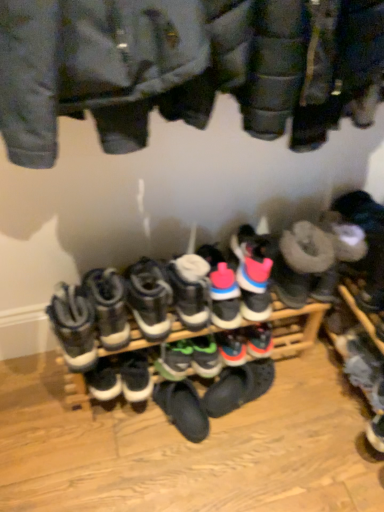
The height and width of the screenshot is (512, 384). Describe the element at coordinates (222, 289) in the screenshot. I see `pink suede sneakers at center, the seventh footwear positioned from the left` at that location.

This screenshot has height=512, width=384. Identify the location of white leather sneakers at center, which appears as the 2th footwear when viewed from the left. (108, 306).

Identify the location of white suede sneaker at lower right, which is the eighth footwear in left-to-right order. tap(363, 366).

Image resolution: width=384 pixels, height=512 pixels. What do you see at coordinates (191, 290) in the screenshot?
I see `white suede sneakers at center, placed as the sixth footwear when sorted from left to right` at bounding box center [191, 290].

Consider the image. Measure the distance between black suede sneaker at center, marked as the third footwear in a left-to-right arrangement, and camera.

A distance of 1.23 meters exists between black suede sneaker at center, marked as the third footwear in a left-to-right arrangement, and camera.

In the scene shown: How much space does black suede sneaker at center, marked as the third footwear in a left-to-right arrangement, occupy horizontally?

11.61 centimeters.

The height and width of the screenshot is (512, 384). I want to click on rubberized black shoes at center, so click(108, 374).

Considering the sizes of white suede sneakers at center, acting as the fourth footwear starting from the right, and white leather sneakers at center, which is the 1th footwear in left-to-right order, in the image, is white suede sneakers at center, acting as the fourth footwear starting from the right, wider or thinner than white leather sneakers at center, which is the 1th footwear in left-to-right order,?

Considering their sizes, white suede sneakers at center, acting as the fourth footwear starting from the right, looks broader than white leather sneakers at center, which is the 1th footwear in left-to-right order.

Where is `the 2nd footwear located above the white leather sneakers at center, which appears as the 9th footwear when viewed from the right (from a real-world perspective)`? the 2nd footwear located above the white leather sneakers at center, which appears as the 9th footwear when viewed from the right (from a real-world perspective) is located at coordinates (191, 290).

Do you think white suede sneakers at center, acting as the fourth footwear starting from the right, is within white leather sneakers at center, which appears as the 9th footwear when viewed from the right, or outside of it?

white suede sneakers at center, acting as the fourth footwear starting from the right, is not enclosed by white leather sneakers at center, which appears as the 9th footwear when viewed from the right.

Consider the image. Who is more distant, white suede sneakers at center, acting as the fourth footwear starting from the right, or white leather sneakers at center, which is the 1th footwear in left-to-right order?

Positioned behind is white suede sneakers at center, acting as the fourth footwear starting from the right.

You are a GUI agent. You are given a task and a screenshot of the screen. Output one action in this format:
    pyautogui.click(x=<x>, y=<y>)
    Task: Click on the 6th footwear in front of the green suede sneakers at center, which is the 5th footwear in left-to-right order, counting from the anchor's position
    This screenshot has height=512, width=384.
    Given the screenshot: What is the action you would take?
    pyautogui.click(x=108, y=306)

Considering the positions of objects white leather sneakers at center, which is the eighth footwear in right-to-left order, and green suede sneakers at center, the fifth footwear positioned from the right, in the image provided, who is more to the right, white leather sneakers at center, which is the eighth footwear in right-to-left order, or green suede sneakers at center, the fifth footwear positioned from the right,?

green suede sneakers at center, the fifth footwear positioned from the right.

Who is shorter, white leather sneakers at center, which appears as the 2th footwear when viewed from the left, or green suede sneakers at center, the fifth footwear positioned from the right?

Standing shorter between the two is green suede sneakers at center, the fifth footwear positioned from the right.

Is the position of white leather sneakers at center, which is the eighth footwear in right-to-left order, less distant than that of green suede sneakers at center, the fifth footwear positioned from the right?

Yes, white leather sneakers at center, which is the eighth footwear in right-to-left order, is in front of green suede sneakers at center, the fifth footwear positioned from the right.

From a real-world perspective, between rubberized black shoes at center and white suede sneakers at center, acting as the fourth footwear starting from the right, who is vertically higher?

In real-world perspective, white suede sneakers at center, acting as the fourth footwear starting from the right, is above.

Is rubberized black shoes at center oriented away from white suede sneakers at center, acting as the fourth footwear starting from the right?

No, rubberized black shoes at center's orientation is not away from white suede sneakers at center, acting as the fourth footwear starting from the right.

Considering the sizes of objects rubberized black shoes at center and white suede sneakers at center, acting as the fourth footwear starting from the right, in the image provided, who is wider, rubberized black shoes at center or white suede sneakers at center, acting as the fourth footwear starting from the right,?

rubberized black shoes at center.

Looking at this image, considering the positions of objects rubberized black shoes at center and white suede sneakers at center, placed as the sixth footwear when sorted from left to right, in the image provided, who is behind, rubberized black shoes at center or white suede sneakers at center, placed as the sixth footwear when sorted from left to right,?

rubberized black shoes at center is further away from the camera.

Is point (138, 351) closer or farther from the camera than point (371, 298)?

Point (138, 351) appears to be closer to the viewer than point (371, 298).

Consider the image. Considering the sizes of objects rubberized black shoes at center and suede boot at right, which is the first footwear from right to left, in the image provided, who is bigger, rubberized black shoes at center or suede boot at right, which is the first footwear from right to left,?

rubberized black shoes at center is bigger.

From the image's perspective, between rubberized black shoes at center and suede boot at right, which is the 9th footwear in left-to-right order, who is located below?

rubberized black shoes at center.

Does white leather sneakers at center, which is the eighth footwear in right-to-left order, have a lesser width compared to pink suede sneakers at center, the seventh footwear positioned from the left?

Yes.

Considering the positions of point (114, 322) and point (211, 280), is point (114, 322) closer or farther from the camera than point (211, 280)?

Point (114, 322).

How much distance is there between white leather sneakers at center, which appears as the 2th footwear when viewed from the left, and pink suede sneakers at center, the seventh footwear positioned from the left?

white leather sneakers at center, which appears as the 2th footwear when viewed from the left, and pink suede sneakers at center, the seventh footwear positioned from the left, are 10.64 inches apart.

Which object is closer to the camera taking this photo, white leather sneakers at center, which appears as the 2th footwear when viewed from the left, or pink suede sneakers at center, the seventh footwear positioned from the left?

Positioned in front is white leather sneakers at center, which appears as the 2th footwear when viewed from the left.

Could you tell me if green suede sneakers at center, which is the 5th footwear in left-to-right order, is turned towards rubberized black shoes at center?

Yes, green suede sneakers at center, which is the 5th footwear in left-to-right order, is oriented towards rubberized black shoes at center.

Is the surface of green suede sneakers at center, which is the 5th footwear in left-to-right order, in direct contact with rubberized black shoes at center?

No, green suede sneakers at center, which is the 5th footwear in left-to-right order, is not making contact with rubberized black shoes at center.

Considering the relative positions of green suede sneakers at center, which is the 5th footwear in left-to-right order, and rubberized black shoes at center in the image provided, is green suede sneakers at center, which is the 5th footwear in left-to-right order, to the left of rubberized black shoes at center from the viewer's perspective?

Yes, green suede sneakers at center, which is the 5th footwear in left-to-right order, is to the left of rubberized black shoes at center.

Which object is thinner, green suede sneakers at center, the fifth footwear positioned from the right, or rubberized black shoes at center?

green suede sneakers at center, the fifth footwear positioned from the right.

Is there a large distance between white leather sneakers at center, which appears as the 2th footwear when viewed from the left, and leather sneakers at center, arranged as the 6th footwear when viewed from the right?

They are positioned close to each other.

Is white leather sneakers at center, which appears as the 2th footwear when viewed from the left, shorter than leather sneakers at center, the 4th footwear in the left-to-right sequence?

In fact, white leather sneakers at center, which appears as the 2th footwear when viewed from the left, may be taller than leather sneakers at center, the 4th footwear in the left-to-right sequence.

In the scene shown: From the image's perspective, which is above, white leather sneakers at center, which appears as the 2th footwear when viewed from the left, or leather sneakers at center, arranged as the 6th footwear when viewed from the right?

leather sneakers at center, arranged as the 6th footwear when viewed from the right, is shown above in the image.

Is white leather sneakers at center, which is the eighth footwear in right-to-left order, oriented towards leather sneakers at center, the 4th footwear in the left-to-right sequence?

No, white leather sneakers at center, which is the eighth footwear in right-to-left order, is not oriented towards leather sneakers at center, the 4th footwear in the left-to-right sequence.

This screenshot has width=384, height=512. In order to click on the 4th footwear above the white leather sneakers at center, which appears as the 9th footwear when viewed from the right (from the image's perspective) in this screenshot , I will do `click(191, 290)`.

Where is `the 6th footwear in front when counting from the green suede sneakers at center, which is the 5th footwear in left-to-right order`? the 6th footwear in front when counting from the green suede sneakers at center, which is the 5th footwear in left-to-right order is located at coordinates (108, 306).

From the image, which object appears to be nearer to white suede sneaker at lower right, positioned as the 2th footwear in right-to-left order, white leather sneakers at center, which appears as the 2th footwear when viewed from the left, or rubberized black shoes at center?

rubberized black shoes at center lies closer to white suede sneaker at lower right, positioned as the 2th footwear in right-to-left order, than the other object.

Consider the image. Which object lies further to the anchor point white suede sneaker at lower right, positioned as the 2th footwear in right-to-left order, suede boot at right, which is the 9th footwear in left-to-right order, or green suede sneakers at center, which is the 5th footwear in left-to-right order?

green suede sneakers at center, which is the 5th footwear in left-to-right order, is further to white suede sneaker at lower right, positioned as the 2th footwear in right-to-left order.

From the image, which object appears to be nearer to pink suede sneakers at center, the seventh footwear positioned from the left, white leather sneakers at center, which appears as the 2th footwear when viewed from the left, or white leather sneakers at center, which is the 1th footwear in left-to-right order?

The object closer to pink suede sneakers at center, the seventh footwear positioned from the left, is white leather sneakers at center, which appears as the 2th footwear when viewed from the left.

Estimate the real-world distances between objects in this image. Which object is further from white suede sneakers at center, placed as the sixth footwear when sorted from left to right, white leather sneakers at center, which appears as the 2th footwear when viewed from the left, or white suede sneaker at lower right, which is the eighth footwear in left-to-right order?

white suede sneaker at lower right, which is the eighth footwear in left-to-right order, lies further to white suede sneakers at center, placed as the sixth footwear when sorted from left to right, than the other object.

Considering their positions, is black suede sneaker at center, the seventh footwear when ordered from right to left, positioned closer to suede boot at right, which is the 9th footwear in left-to-right order, than white suede sneaker at lower right, positioned as the 2th footwear in right-to-left order?

white suede sneaker at lower right, positioned as the 2th footwear in right-to-left order.

Which object lies further to the anchor point white leather sneakers at center, which is the eighth footwear in right-to-left order, leather sneakers at center, arranged as the 6th footwear when viewed from the right, or white suede sneaker at lower right, which is the eighth footwear in left-to-right order?

The object further to white leather sneakers at center, which is the eighth footwear in right-to-left order, is white suede sneaker at lower right, which is the eighth footwear in left-to-right order.

From the image, which object appears to be farther from suede boot at right, which is the first footwear from right to left, white leather sneakers at center, which is the 1th footwear in left-to-right order, or white suede sneaker at lower right, positioned as the 2th footwear in right-to-left order?

Based on the image, white leather sneakers at center, which is the 1th footwear in left-to-right order, appears to be further to suede boot at right, which is the first footwear from right to left.

Considering their positions, is leather sneakers at center, arranged as the 6th footwear when viewed from the right, positioned closer to white suede sneaker at lower right, positioned as the 2th footwear in right-to-left order, than white leather sneakers at center, which appears as the 2th footwear when viewed from the left?

leather sneakers at center, arranged as the 6th footwear when viewed from the right, is positioned closer to the anchor white suede sneaker at lower right, positioned as the 2th footwear in right-to-left order.

The width and height of the screenshot is (384, 512). Find the location of `shelf between leather sneakers at center, the 4th footwear in the left-to-right sequence, and green suede sneakers at center, which is the 5th footwear in left-to-right order, from top to bottom`. shelf between leather sneakers at center, the 4th footwear in the left-to-right sequence, and green suede sneakers at center, which is the 5th footwear in left-to-right order, from top to bottom is located at coordinates (108, 374).

In order to click on footwear between rubberized black shoes at center and white suede sneaker at lower right, positioned as the 2th footwear in right-to-left order in this screenshot , I will do `click(222, 289)`.

At what (x,y) coordinates should I click in order to perform the action: click on shelf located between white leather sneakers at center, which appears as the 9th footwear when viewed from the right, and suede boot at right, which is the 9th footwear in left-to-right order, in the left-right direction. Please return your answer as a coordinate pair (x, y). This screenshot has height=512, width=384. Looking at the image, I should click on (108, 374).

Locate an element on the screen. The image size is (384, 512). shelf between white leather sneakers at center, which appears as the 9th footwear when viewed from the right, and white suede sneaker at lower right, which is the eighth footwear in left-to-right order is located at coordinates tap(108, 374).